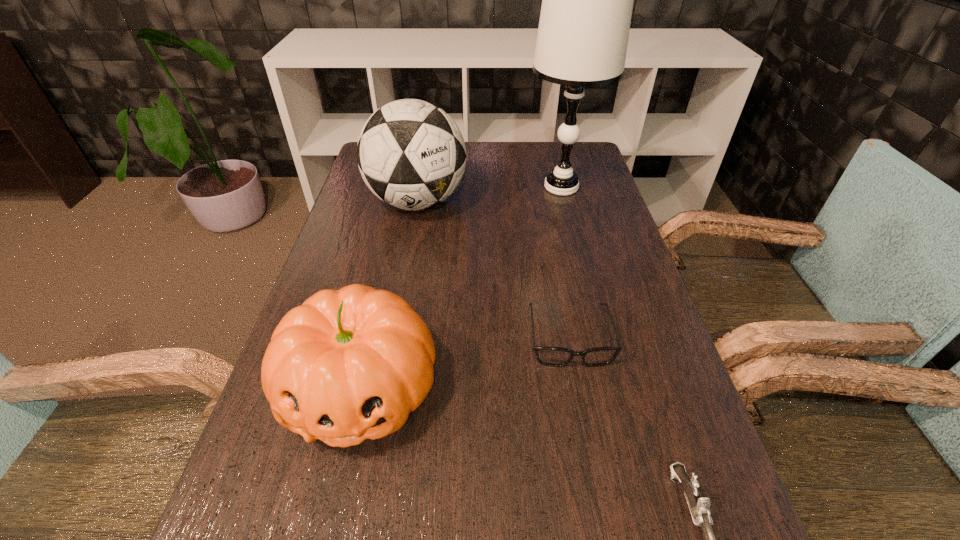
Locate an element on the screen. This screenshot has width=960, height=540. vacant space that is in between the spectacles and the tallest object is located at coordinates (565, 262).

Where is `free spot between the spectacles and the soccer ball`? free spot between the spectacles and the soccer ball is located at coordinates (493, 270).

At what (x,y) coordinates should I click in order to perform the action: click on vacant space in between the third shortest object and the spectacles. Please return your answer as a coordinate pair (x, y). The height and width of the screenshot is (540, 960). Looking at the image, I should click on (465, 362).

Where is `free space between the tallest object and the soccer ball`? The width and height of the screenshot is (960, 540). free space between the tallest object and the soccer ball is located at coordinates (490, 194).

Locate an element on the screen. This screenshot has height=540, width=960. vacant area between the soccer ball and the spectacles is located at coordinates (493, 270).

Identify which object is the fourth nearest to the soccer ball. Please provide its 2D coordinates. Your answer should be formatted as a tuple, i.e. [(x, y)], where the tuple contains the x and y coordinates of a point satisfying the conditions above.

[(699, 506)]

Locate an element on the screen. the closest object to the soccer ball is located at coordinates (587, 0).